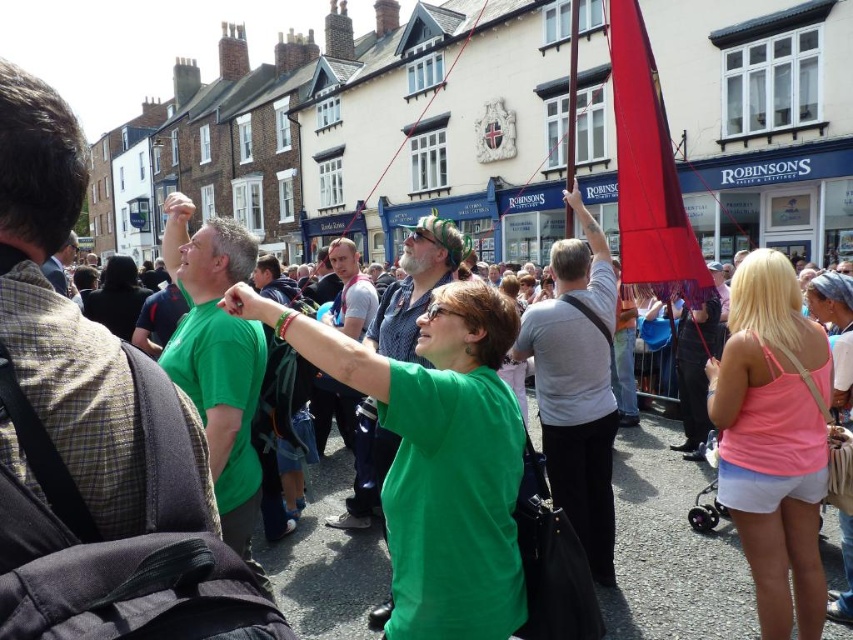
Question: Which point appears farthest from the camera in this image?

Choices:
 (A) (722, 468)
 (B) (700, 278)

Answer: (B)

Question: Which of the following is the closest to the observer?

Choices:
 (A) (674, 291)
 (B) (776, 330)

Answer: (B)

Question: Is pink fabric tank top at center below silky red flag at upper right?

Choices:
 (A) no
 (B) yes

Answer: (B)

Question: Is pink fabric tank top at center positioned before silky red flag at upper right?

Choices:
 (A) no
 (B) yes

Answer: (B)

Question: Does pink fabric tank top at center have a lesser width compared to silky red flag at upper right?

Choices:
 (A) no
 (B) yes

Answer: (B)